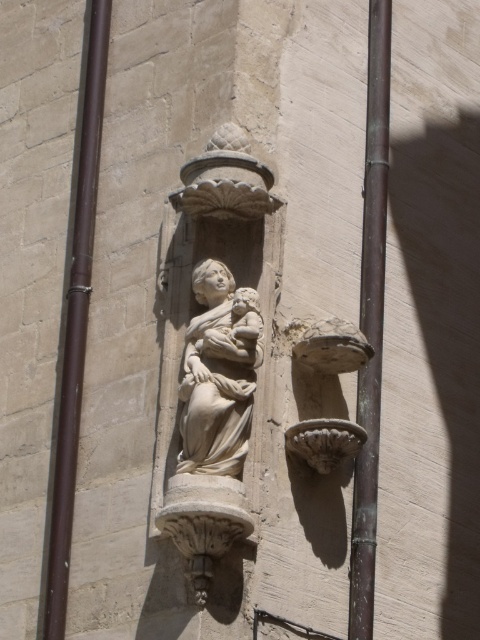
Question: Estimate the real-world distances between objects in this image. Which object is farther from the white marble statue at center?

Choices:
 (A) bronze metallic pole at center
 (B) brown metal pole at left

Answer: (B)

Question: Which object appears closest to the camera in this image?

Choices:
 (A) bronze metallic pole at center
 (B) white marble statue at center
 (C) brown metal pole at left

Answer: (B)

Question: Does bronze metallic pole at center have a greater width compared to white marble statue at center?

Choices:
 (A) yes
 (B) no

Answer: (B)

Question: In this image, where is bronze metallic pole at center located relative to white marble statue at center?

Choices:
 (A) right
 (B) left

Answer: (A)

Question: Which object is closer to the camera taking this photo?

Choices:
 (A) white marble statue at center
 (B) brown metal pole at left
 (C) bronze metallic pole at center

Answer: (A)

Question: Can you confirm if bronze metallic pole at center is positioned to the right of white marble statue at center?

Choices:
 (A) yes
 (B) no

Answer: (A)